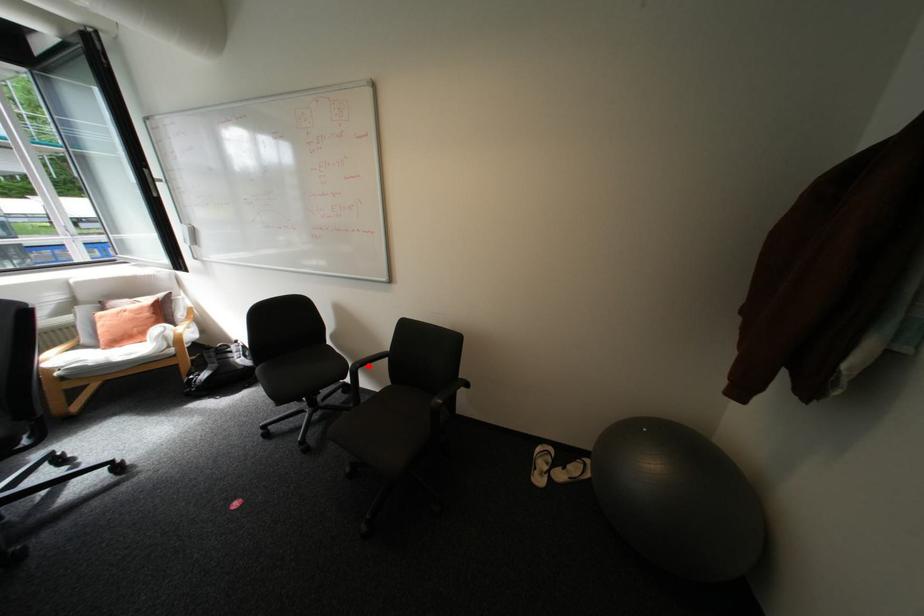
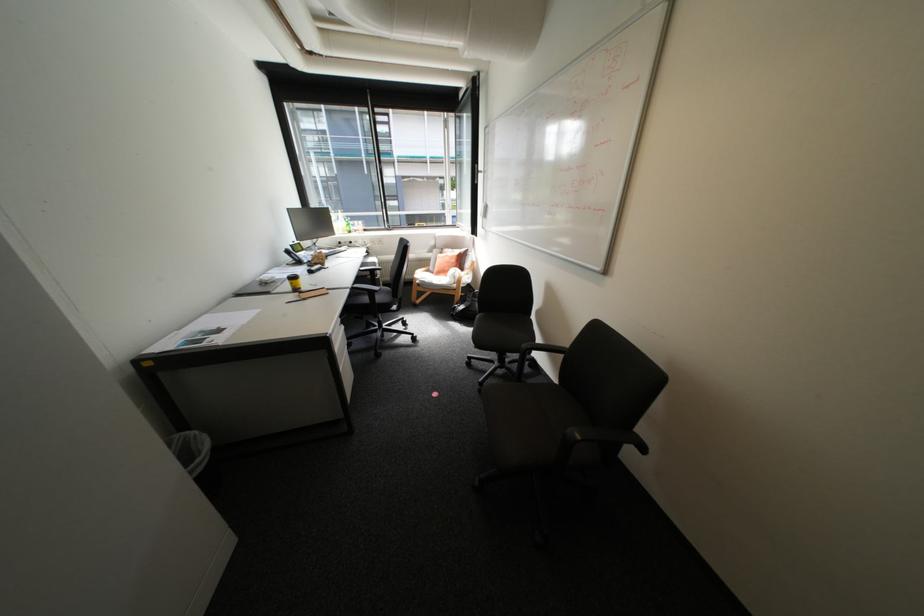
Find the pixel in the second image that matches the highlighted location in the first image.

(539, 347)